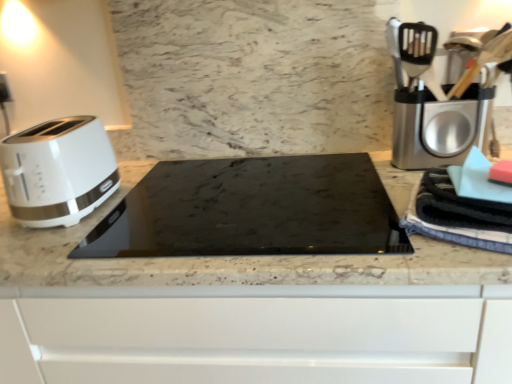
The height and width of the screenshot is (384, 512). Identify the location of vacant area that lies between white glossy toaster at left and silver metallic coffee machine at right. (228, 193).